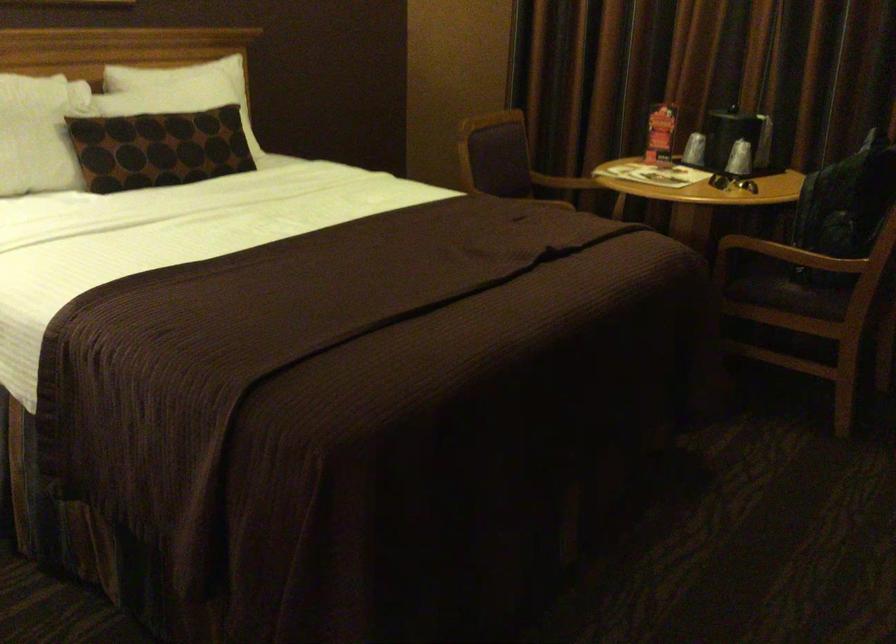
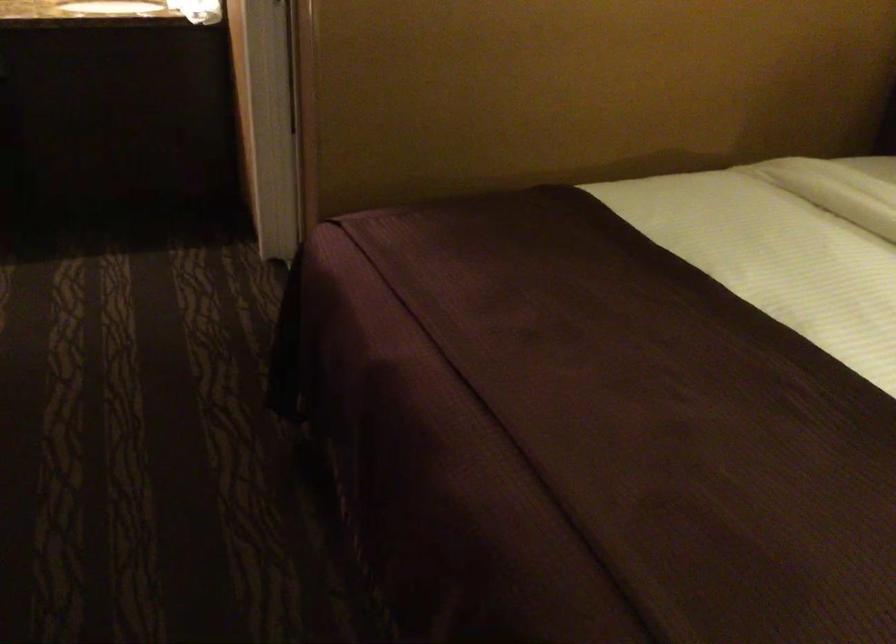
The images are taken continuously from a first-person perspective. In which direction is your viewpoint rotating?

The camera's rotation is toward left-down.